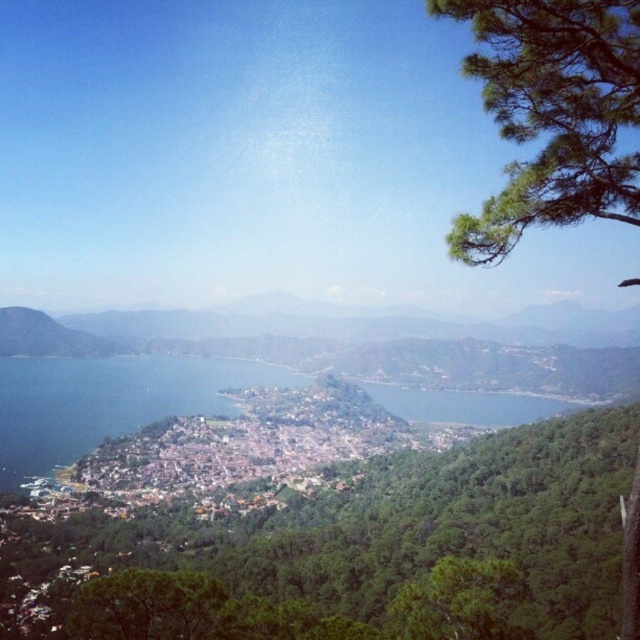
You are standing at the point labeled as point (355, 552) in the image. Looking around, which direction would you face to see the green leafy tree at center?

You are already at the green leafy tree at center, so you can look in any direction around that point to see it.